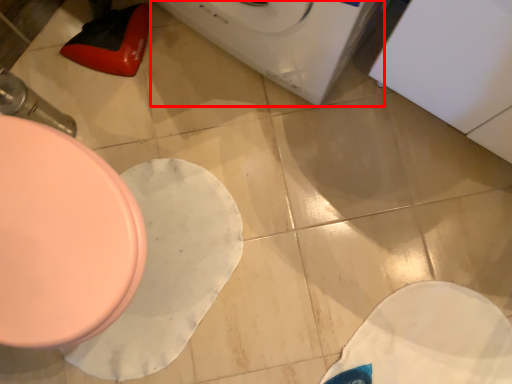
Question: In this image, where is washing machine (annotated by the red box) located relative to toilet?

Choices:
 (A) right
 (B) left

Answer: (A)